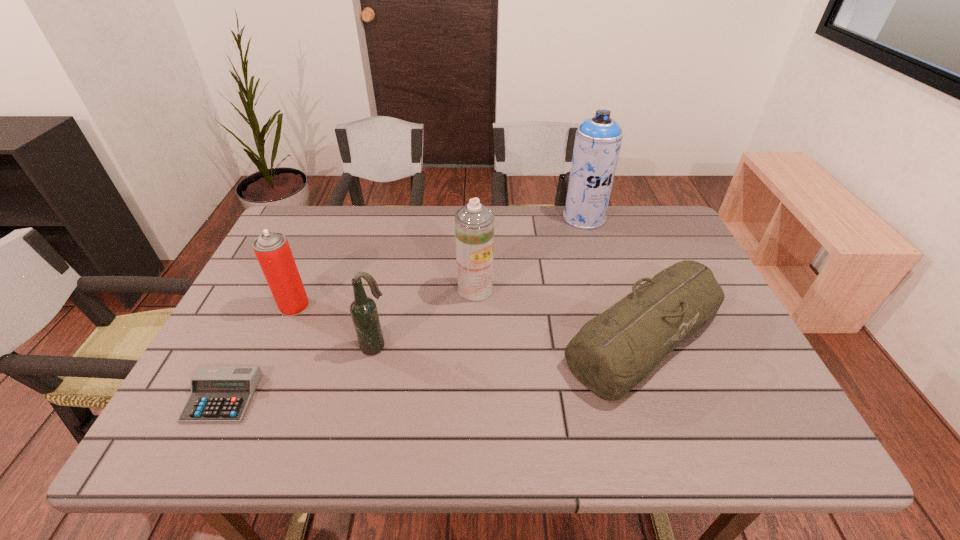
The image size is (960, 540). Identify the location of free space between the leftmost aerosol can and the second aerosol can from right to left. (385, 298).

This screenshot has height=540, width=960. What are the coordinates of `unoccupied position between the calculator and the duffel bag` in the screenshot? It's located at (433, 367).

Locate an element on the screen. This screenshot has width=960, height=540. vacant area that lies between the shortest object and the third object from right to left is located at coordinates (348, 343).

Locate which object is the fifth closest to the fourth object from right to left. Please provide its 2D coordinates. Your answer should be formatted as a tuple, i.e. [(x, y)], where the tuple contains the x and y coordinates of a point satisfying the conditions above.

[(598, 139)]

Locate an element on the screen. object that stands as the third closest to the calculator is located at coordinates click(x=474, y=223).

Select which aerosol can is the third closest to the calculator. Please provide its 2D coordinates. Your answer should be formatted as a tuple, i.e. [(x, y)], where the tuple contains the x and y coordinates of a point satisfying the conditions above.

[(598, 139)]

Locate which aerosol can is the third closest to the calculator. Please provide its 2D coordinates. Your answer should be formatted as a tuple, i.e. [(x, y)], where the tuple contains the x and y coordinates of a point satisfying the conditions above.

[(598, 139)]

Locate an element on the screen. The image size is (960, 540). vacant space that satisfies the following two spatial constraints: 1. on the back side of the calculator; 2. on the right side of the fourth object from right to left is located at coordinates (249, 346).

Where is `vacant space that satisfies the following two spatial constraints: 1. on the back side of the second aerosol can from right to left; 2. on the right side of the beer bottle`? This screenshot has height=540, width=960. vacant space that satisfies the following two spatial constraints: 1. on the back side of the second aerosol can from right to left; 2. on the right side of the beer bottle is located at coordinates (388, 289).

Find the location of `vacant space that satisfies the following two spatial constraints: 1. on the front side of the leftmost aerosol can; 2. on the right side of the beer bottle`. vacant space that satisfies the following two spatial constraints: 1. on the front side of the leftmost aerosol can; 2. on the right side of the beer bottle is located at coordinates (276, 346).